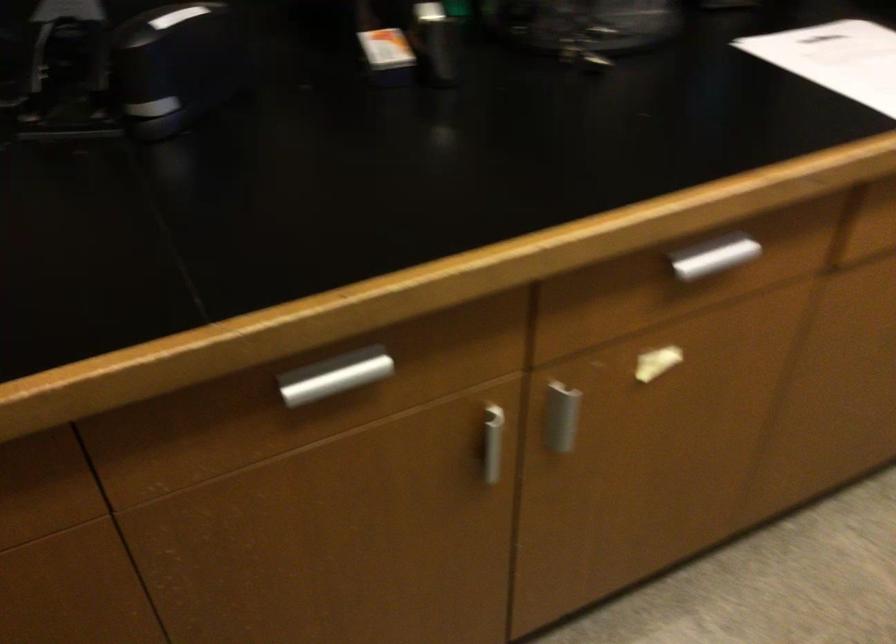
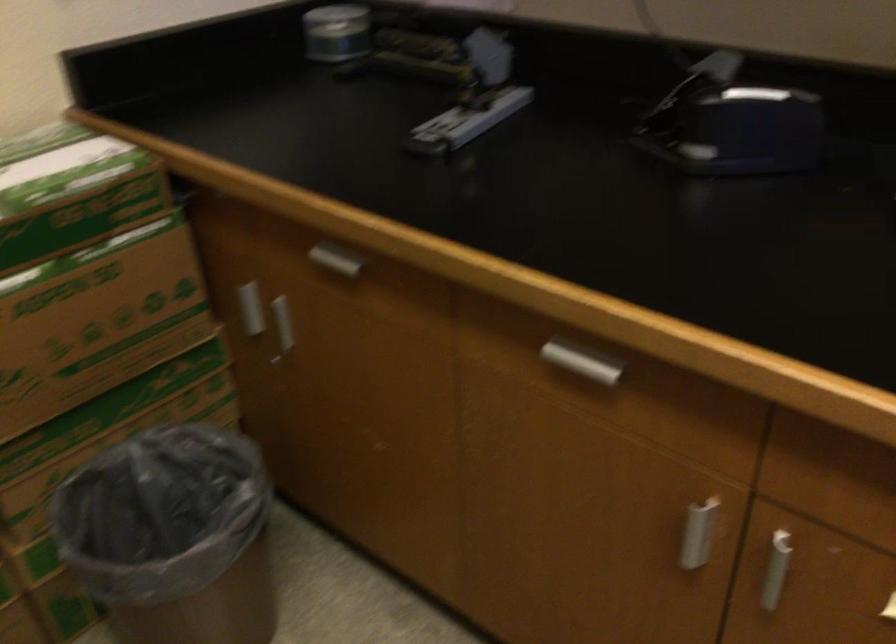
Locate, in the second image, the point that corresponds to (x=493, y=451) in the first image.

(695, 536)